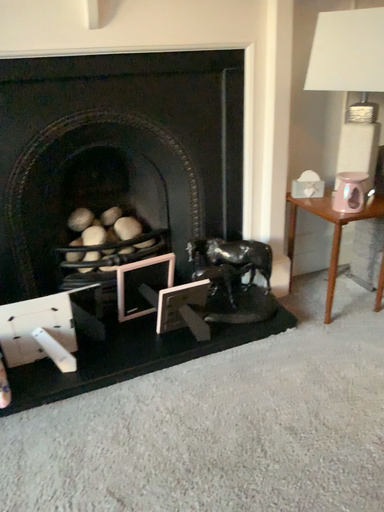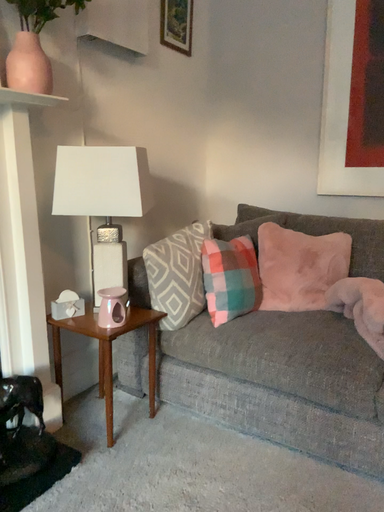
Question: How did the camera likely rotate when shooting the video?

Choices:
 (A) rotated left
 (B) rotated right

Answer: (B)